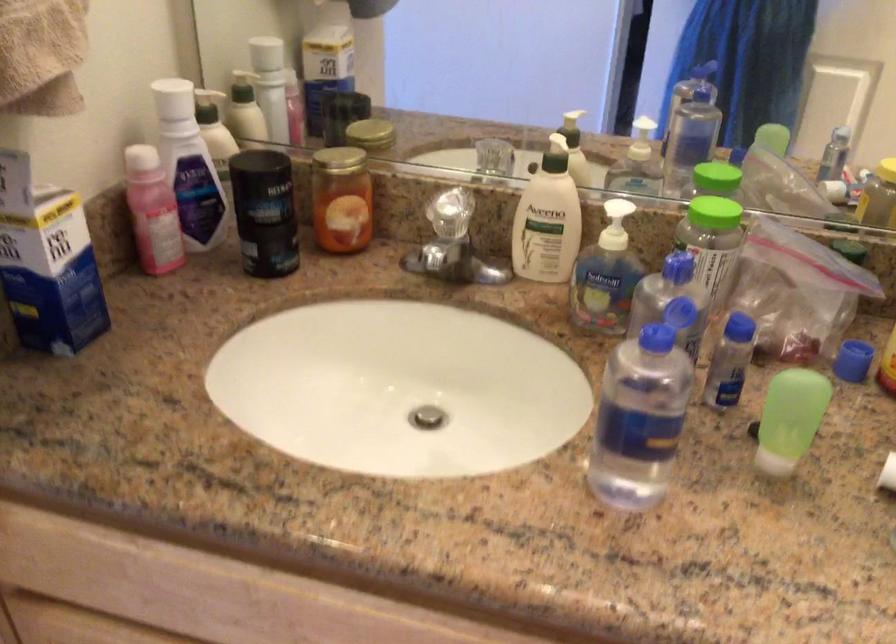
Where is `green bottle cap`? The width and height of the screenshot is (896, 644). green bottle cap is located at coordinates (711, 243).